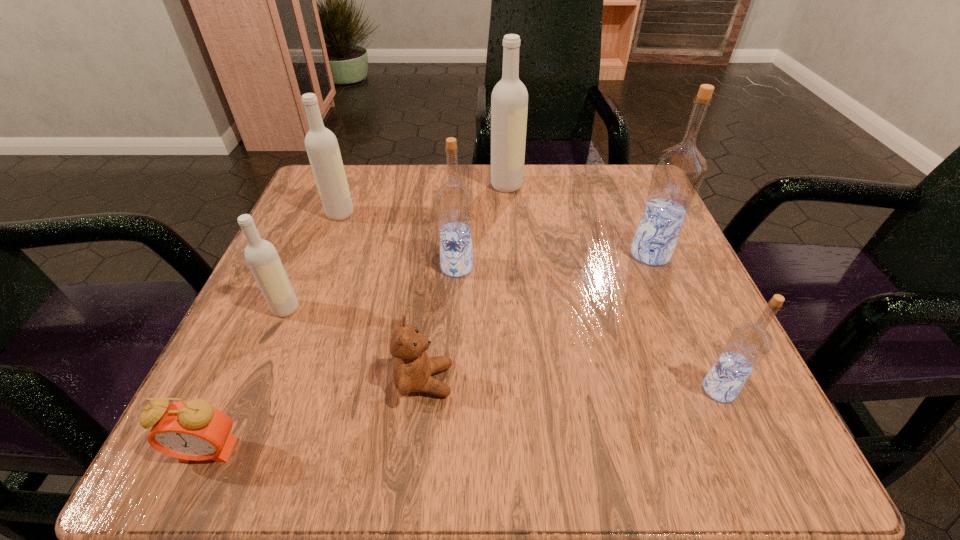
This screenshot has height=540, width=960. Identify the location of the nearest blue vodka. (748, 344).

The image size is (960, 540). Identify the location of teddy bear. (412, 368).

At what (x,y) coordinates should I click in order to perform the action: click on the nearest object. Please return your answer as a coordinate pair (x, y). Looking at the image, I should click on (194, 430).

You are a GUI agent. You are given a task and a screenshot of the screen. Output one action in this format:
    pyautogui.click(x=<x>, y=<y>)
    Task: Click on the pink alarm clock
    The height and width of the screenshot is (540, 960).
    Given the screenshot: What is the action you would take?
    pyautogui.click(x=194, y=430)

Where is `free space located 0.090m on the front of the farthest object`? free space located 0.090m on the front of the farthest object is located at coordinates (509, 220).

Where is `vacant space situated 0.130m on the back of the biggest blue vodka`? vacant space situated 0.130m on the back of the biggest blue vodka is located at coordinates (628, 201).

The width and height of the screenshot is (960, 540). I want to click on vacant space positioned on the right of the second farthest white vodka, so click(x=523, y=214).

I want to click on vacant position located 0.200m on the left of the fourth vodka from right to left, so click(x=325, y=267).

This screenshot has height=540, width=960. Identify the location of free space located 0.330m on the back of the fourth nearest object. (337, 188).

Find the location of a particular element. This screenshot has width=960, height=540. free space located 0.070m on the front of the smallest blue vodka is located at coordinates (749, 456).